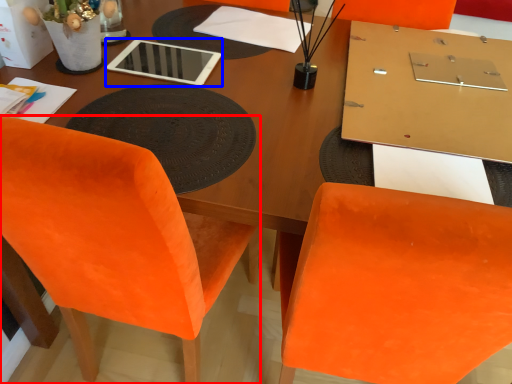
Question: Which of the following is the farthest to the observer, chair (highlighted by a red box) or tablet computer (highlighted by a blue box)?

Choices:
 (A) chair
 (B) tablet computer

Answer: (B)